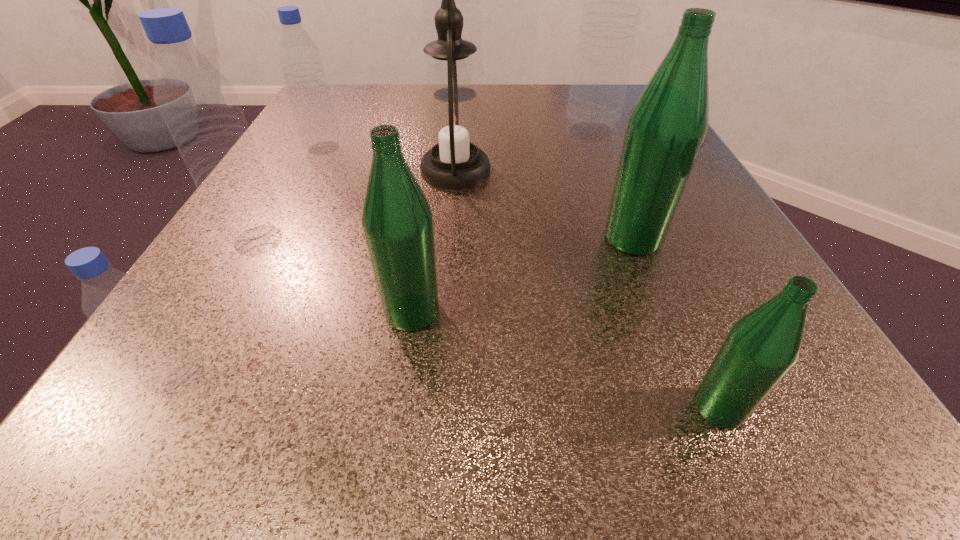
Locate an element on the screen. free spot located 0.300m on the left of the nearest green bottle is located at coordinates (403, 407).

Locate an element on the screen. object present at the near left corner is located at coordinates (124, 310).

Locate an element on the screen. This screenshot has height=540, width=960. object present at the far right corner is located at coordinates (613, 3).

The image size is (960, 540). Identify the location of object situated at the near right corner. (762, 346).

Find the location of a particular element. This screenshot has height=540, width=960. vacant space at the far edge is located at coordinates [562, 113].

Image resolution: width=960 pixels, height=540 pixels. What are the coordinates of `free location at the left edge of the desktop` in the screenshot? It's located at (276, 196).

Image resolution: width=960 pixels, height=540 pixels. I want to click on free space at the right edge, so click(x=746, y=262).

Where is `vacant space at the near left corner of the desktop`? This screenshot has width=960, height=540. vacant space at the near left corner of the desktop is located at coordinates (151, 415).

Where is `free space at the near right corner`? Image resolution: width=960 pixels, height=540 pixels. free space at the near right corner is located at coordinates (845, 406).

The width and height of the screenshot is (960, 540). Find the location of `vacant space that's between the nearest green bottle and the third nearest object`. vacant space that's between the nearest green bottle and the third nearest object is located at coordinates (565, 359).